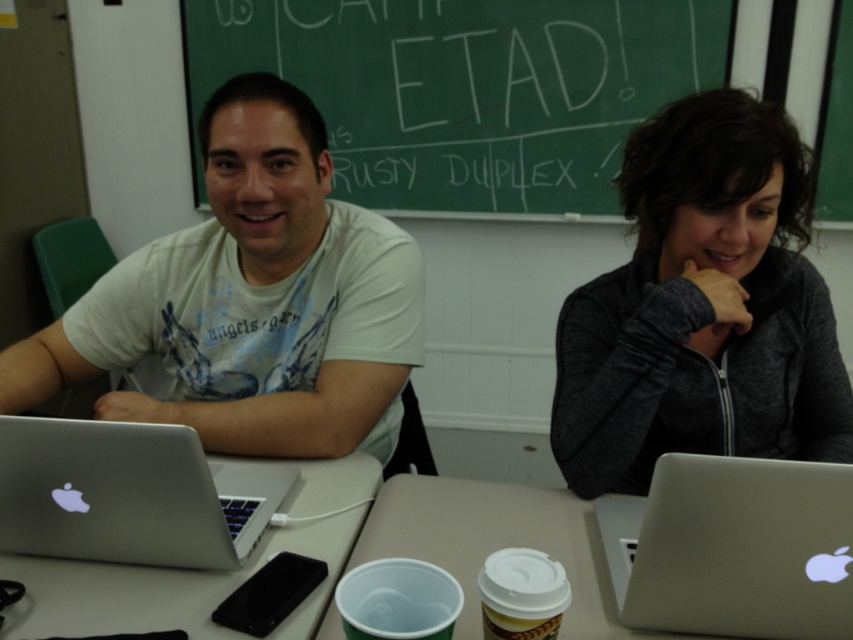
You are a teacher preparing for a lesson and notice the green chalkboard at upper center and the white plastic cup at center. Which object is taller?

The green chalkboard at upper center is taller than the white plastic cup at center.

You are a student sitting at the table in the classroom scene. You need to write something on the green chalkboard at upper center but your white plastic cup at center is blocking the way. Can you move the cup to the right to access the chalkboard?

The green chalkboard at upper center is positioned on the left side of white plastic cup at center, so moving the cup to the right would allow access to the chalkboard.